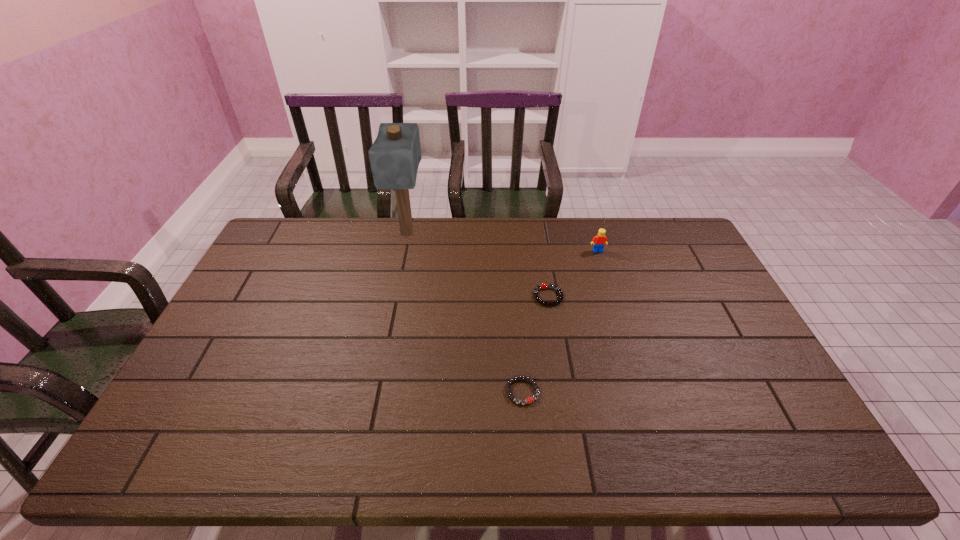
Where is `empty space between the second nearest object and the leftmost object`? The image size is (960, 540). empty space between the second nearest object and the leftmost object is located at coordinates (478, 265).

Where is `free space between the leftmost object and the nearest object`? This screenshot has width=960, height=540. free space between the leftmost object and the nearest object is located at coordinates (465, 313).

This screenshot has width=960, height=540. What are the coordinates of `free spot between the farther bracelet and the tallest object` in the screenshot? It's located at (478, 265).

Find the location of a particular element. free point between the right bracelet and the rightmost object is located at coordinates (573, 274).

Where is `unoccupied area between the third shortest object and the nearest object`? The width and height of the screenshot is (960, 540). unoccupied area between the third shortest object and the nearest object is located at coordinates (561, 321).

Locate an element on the screen. unoccupied position between the Lego and the mallet is located at coordinates (502, 242).

In order to click on free space that is in between the rightmost object and the tallest object in this screenshot , I will do `click(502, 242)`.

Locate an element on the screen. Image resolution: width=960 pixels, height=540 pixels. empty location between the tallest object and the third object from left to right is located at coordinates (478, 265).

The height and width of the screenshot is (540, 960). In order to click on vacant area that lies between the rightmost object and the mallet in this screenshot , I will do `click(502, 242)`.

What are the coordinates of `free point between the second nearest object and the third shortest object` in the screenshot? It's located at (573, 274).